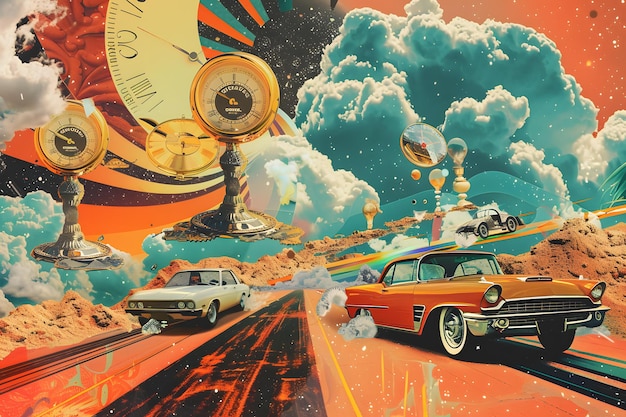
Identify the location of window. (488, 211), (466, 266), (398, 268), (231, 273), (200, 276), (183, 279).